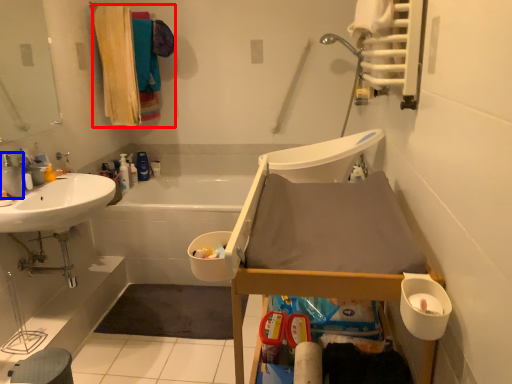
Question: Which point is closer to the camera, laundry (highlighted by a red box) or tap (highlighted by a blue box)?

Choices:
 (A) laundry
 (B) tap

Answer: (B)